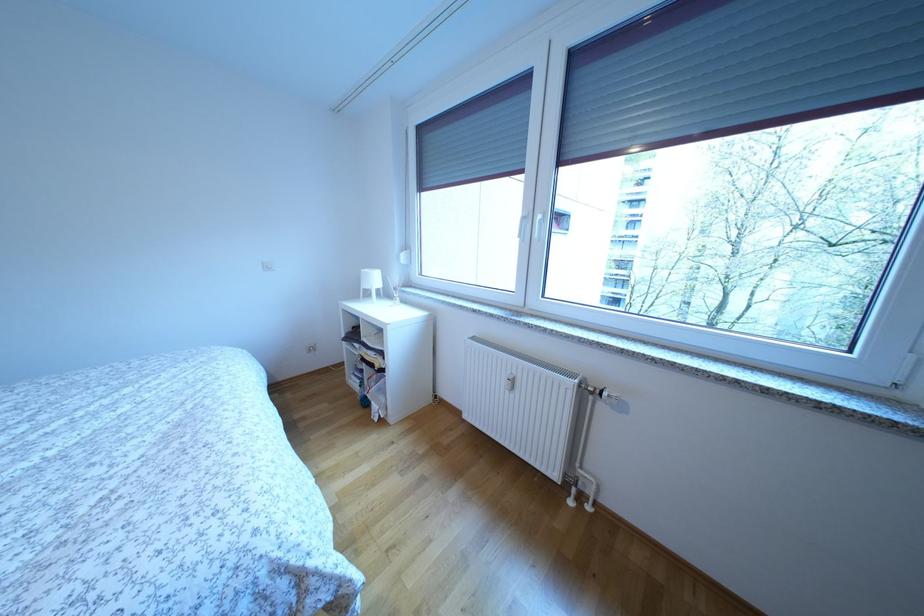
Describe the element at coordinates (268, 265) in the screenshot. I see `a white light switch` at that location.